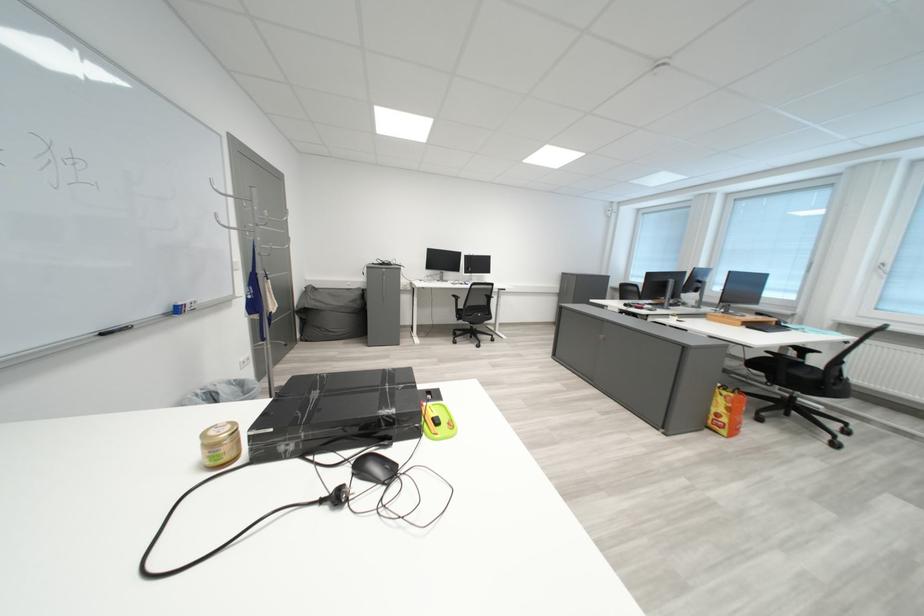
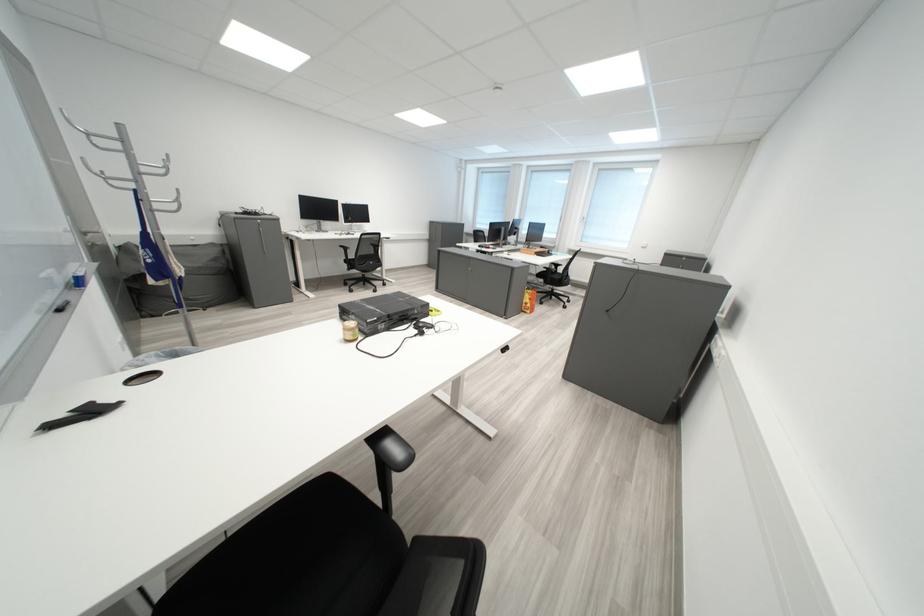
In the second image, find the point that corresponds to the point at 368,302 in the first image.

(228, 262)